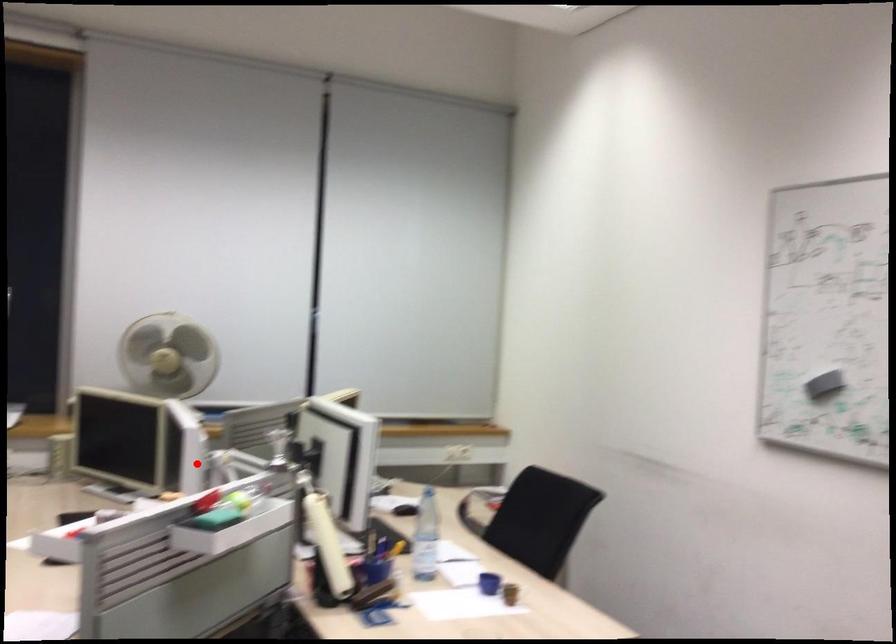
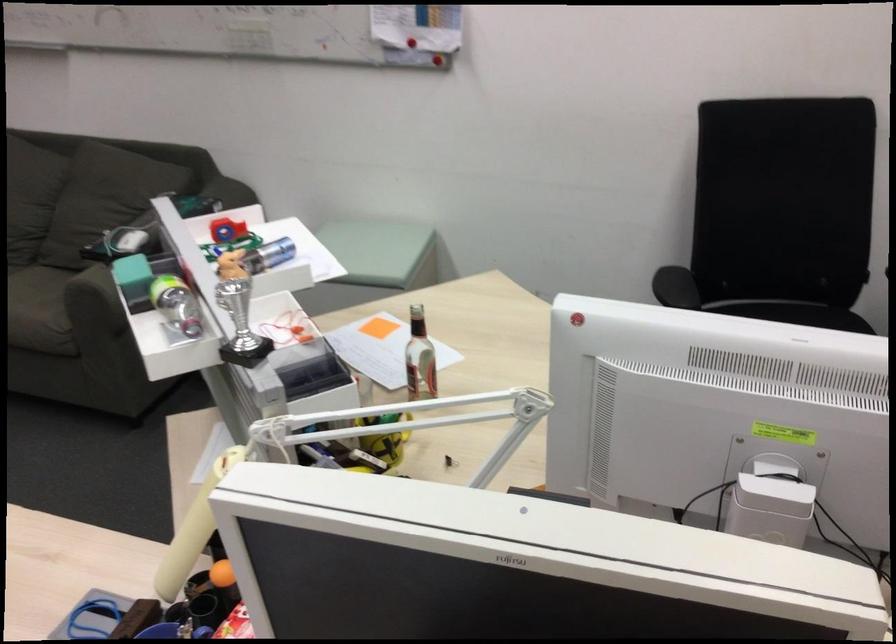
Locate, in the second image, the point that corresponds to the highlighted location in the first image.

(770, 509)